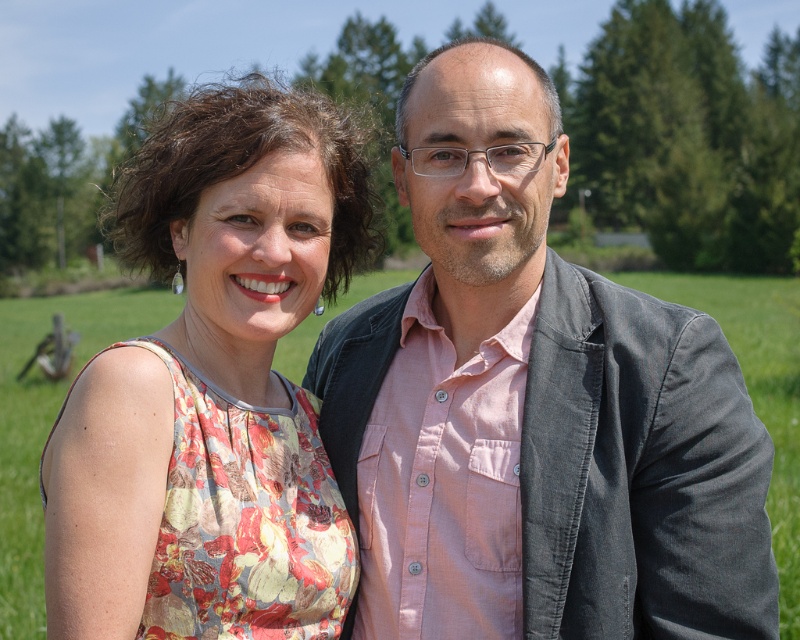
You are a fashion designer who needs to decide which garment to feature in a catalog. The matte gray blazer at center and the floral fabric dress at left are both candidates. Based on their lengths, which one would you choose if you want to highlight a shorter garment?

The matte gray blazer at center is shorter than the floral fabric dress at left, so it would be the better choice for highlighting a shorter garment.

From the picture: You are a photographer standing at the center of the field. You want to take a photo of the floral fabric dress at left and the floral fabric dress at center. Since you can only focus on one dress at a time, which dress should you focus on first to ensure the closest subject is in focus?

The floral fabric dress at left is closer to you than the floral fabric dress at center, so you should focus on the floral fabric dress at left first to ensure the closest subject is in focus.